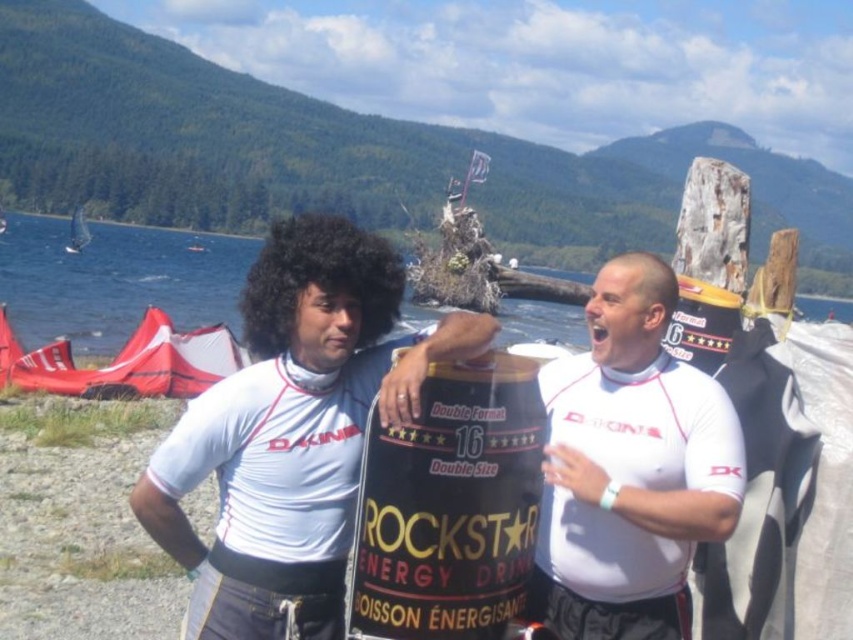
You are a photographer trying to capture both the matte black energy drink can at center and the black matte energy drink can at center in a single shot. Given that your camera has a maximum focus range of 150 feet, will you be able to focus on both objects simultaneously?

The matte black energy drink can at center is 171.94 feet away from the black matte energy drink can at center. Since the distance between them exceeds the camera maximum focus range of 150 feet, the camera cannot focus on both objects simultaneously.

You are a photographer trying to capture a closeup of the black matte energy drink can at center without including the white matte shirt at center in the frame. Based on their sizes, do you think this is possible?

The white matte shirt at center occupies less space than black matte energy drink can at center. Since the shirt is smaller, it might be easier to position the camera to focus solely on the larger can without including the shirt in the frame.

You are standing at the camera position and want to place a 3.5 meter long ladder to reach a point located at point (337,470). Will the ladder be long enough to reach that point?

The distance between the camera and point (337,470) is 3.56 meters. Since the ladder is 3.5 meters long, it is slightly shorter than the required distance. Therefore, the ladder will not be long enough to reach the point.